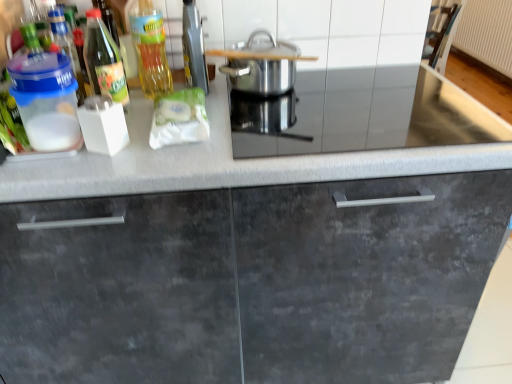
Question: Is stainless steel pot at center positioned with its back to translucent plastic container at upper left?

Choices:
 (A) yes
 (B) no

Answer: (B)

Question: Can you confirm if stainless steel pot at center is bigger than translucent plastic container at upper left?

Choices:
 (A) yes
 (B) no

Answer: (A)

Question: Can we say stainless steel pot at center lies outside translucent plastic container at upper left?

Choices:
 (A) no
 (B) yes

Answer: (B)

Question: From the image's perspective, is stainless steel pot at center on top of translucent plastic container at upper left?

Choices:
 (A) no
 (B) yes

Answer: (B)

Question: From a real-world perspective, is stainless steel pot at center located higher than translucent plastic container at upper left?

Choices:
 (A) no
 (B) yes

Answer: (A)

Question: Is the depth of stainless steel pot at center less than that of translucent plastic container at upper left?

Choices:
 (A) yes
 (B) no

Answer: (B)

Question: Can you confirm if white matte packet at center is thinner than stainless steel pot at center?

Choices:
 (A) yes
 (B) no

Answer: (B)

Question: Is white matte packet at center further to camera compared to stainless steel pot at center?

Choices:
 (A) yes
 (B) no

Answer: (B)

Question: Is white matte packet at center shorter than stainless steel pot at center?

Choices:
 (A) no
 (B) yes

Answer: (B)

Question: Considering the relative sizes of white matte packet at center and stainless steel pot at center in the image provided, is white matte packet at center smaller than stainless steel pot at center?

Choices:
 (A) yes
 (B) no

Answer: (A)

Question: Does white matte packet at center have a greater height compared to stainless steel pot at center?

Choices:
 (A) yes
 (B) no

Answer: (B)

Question: Is white matte packet at center in front of stainless steel pot at center?

Choices:
 (A) no
 (B) yes

Answer: (B)

Question: Considering the relative sizes of stainless steel pot at center and metallic silver toaster at upper center in the image provided, is stainless steel pot at center taller than metallic silver toaster at upper center?

Choices:
 (A) yes
 (B) no

Answer: (B)